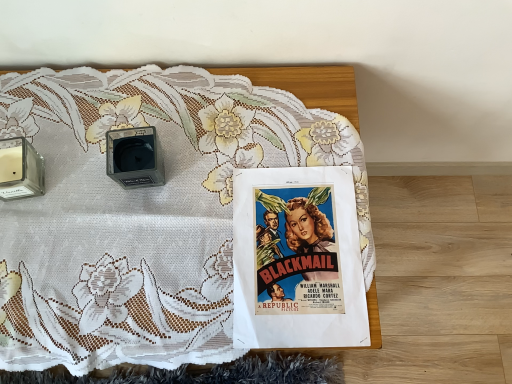
Question: Is transparent glass candle at left, positioned as the 2th speaker in right-to-left order, surrounding matte paper poster at center?

Choices:
 (A) yes
 (B) no

Answer: (B)

Question: Is transparent glass candle at left, acting as the first speaker starting from the left, aimed at matte paper poster at center?

Choices:
 (A) yes
 (B) no

Answer: (B)

Question: Is transparent glass candle at left, acting as the first speaker starting from the left, next to matte paper poster at center and touching it?

Choices:
 (A) yes
 (B) no

Answer: (B)

Question: Is transparent glass candle at left, acting as the first speaker starting from the left, taller than matte paper poster at center?

Choices:
 (A) yes
 (B) no

Answer: (A)

Question: From the image's perspective, is transparent glass candle at left, positioned as the 2th speaker in right-to-left order, above matte paper poster at center?

Choices:
 (A) yes
 (B) no

Answer: (A)

Question: In the image, is white lace tablecloth at upper center positioned in front of or behind matte black speaker at center, positioned as the 2th speaker in left-to-right order?

Choices:
 (A) front
 (B) behind

Answer: (A)

Question: From the image's perspective, relative to matte black speaker at center, positioned as the 2th speaker in left-to-right order, is white lace tablecloth at upper center above or below?

Choices:
 (A) below
 (B) above

Answer: (A)

Question: Would you say white lace tablecloth at upper center is inside or outside matte black speaker at center, placed as the 1th speaker when sorted from right to left?

Choices:
 (A) outside
 (B) inside

Answer: (A)

Question: Considering the positions of white lace tablecloth at upper center and matte black speaker at center, placed as the 1th speaker when sorted from right to left, in the image, is white lace tablecloth at upper center wider or thinner than matte black speaker at center, placed as the 1th speaker when sorted from right to left,?

Choices:
 (A) thin
 (B) wide

Answer: (B)

Question: From the image's perspective, is matte black speaker at center, placed as the 1th speaker when sorted from right to left, located above or below white lace tablecloth at upper center?

Choices:
 (A) above
 (B) below

Answer: (A)

Question: Is point (112, 144) closer or farther from the camera than point (134, 291)?

Choices:
 (A) closer
 (B) farther

Answer: (B)

Question: Is matte black speaker at center, placed as the 1th speaker when sorted from right to left, wider or thinner than white lace tablecloth at upper center?

Choices:
 (A) thin
 (B) wide

Answer: (A)

Question: Choose the correct answer: Is matte black speaker at center, placed as the 1th speaker when sorted from right to left, inside white lace tablecloth at upper center or outside it?

Choices:
 (A) inside
 (B) outside

Answer: (A)

Question: Choose the correct answer: Is matte black speaker at center, placed as the 1th speaker when sorted from right to left, inside transparent glass candle at left, positioned as the 2th speaker in right-to-left order, or outside it?

Choices:
 (A) outside
 (B) inside

Answer: (A)

Question: Based on their positions, is matte black speaker at center, positioned as the 2th speaker in left-to-right order, located to the left or right of transparent glass candle at left, acting as the first speaker starting from the left?

Choices:
 (A) right
 (B) left

Answer: (A)